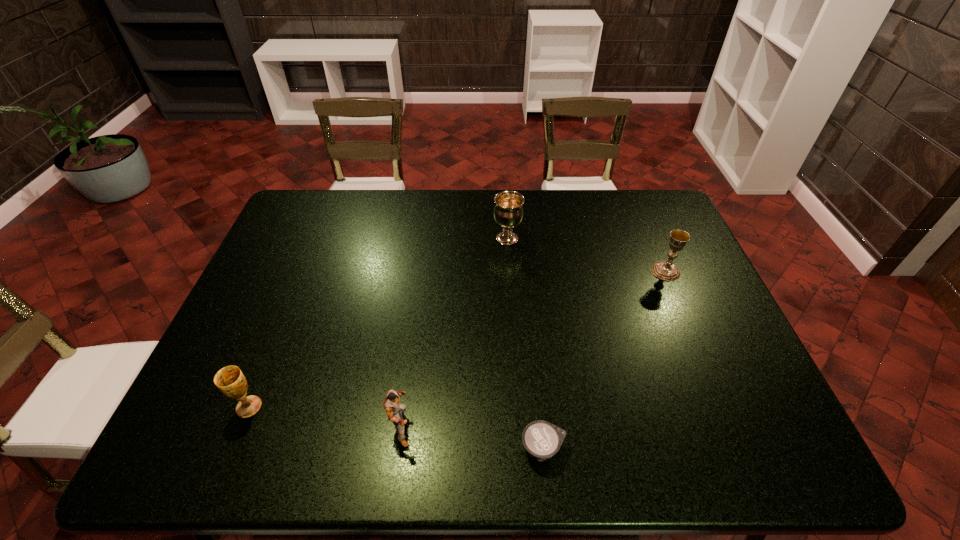
In order to click on empty location between the fourth object from right to left and the nearest chalice in this screenshot , I will do `click(325, 417)`.

Locate an element on the screen. This screenshot has width=960, height=540. vacant point located between the second farthest chalice and the farthest chalice is located at coordinates (587, 255).

I want to click on empty space between the puncher and the shortest object, so click(x=472, y=437).

Find the location of a particular element. This screenshot has width=960, height=540. vacant space in between the second farthest chalice and the yogurt is located at coordinates (604, 360).

What are the coordinates of `vacant space that is in between the leftmost object and the second farthest chalice` in the screenshot? It's located at (457, 339).

I want to click on the second closest object to the fourth object from right to left, so click(230, 380).

Locate an element on the screen. object that ranks as the fourth closest to the nearest chalice is located at coordinates (665, 270).

Identify which chalice is the second closest to the second chalice from right to left. Please provide its 2D coordinates. Your answer should be formatted as a tuple, i.e. [(x, y)], where the tuple contains the x and y coordinates of a point satisfying the conditions above.

[(230, 380)]

Identify which chalice is the second closest to the rightmost chalice. Please provide its 2D coordinates. Your answer should be formatted as a tuple, i.e. [(x, y)], where the tuple contains the x and y coordinates of a point satisfying the conditions above.

[(230, 380)]

At what (x,y) coordinates should I click in order to perform the action: click on vacant space that satisfies the following two spatial constraints: 1. on the front side of the second chalice from right to left; 2. on the front-facing side of the fourth object from right to left. Please return your answer as a coordinate pair (x, y). Looking at the image, I should click on (519, 427).